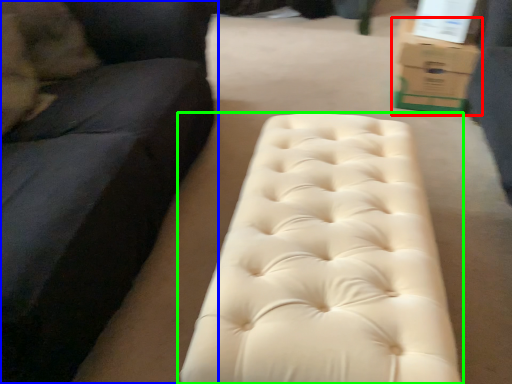
Question: Estimate the real-world distances between objects in this image. Which object is farther from cardboard box (highlighted by a red box), studio couch (highlighted by a blue box) or furniture (highlighted by a green box)?

Choices:
 (A) studio couch
 (B) furniture

Answer: (A)